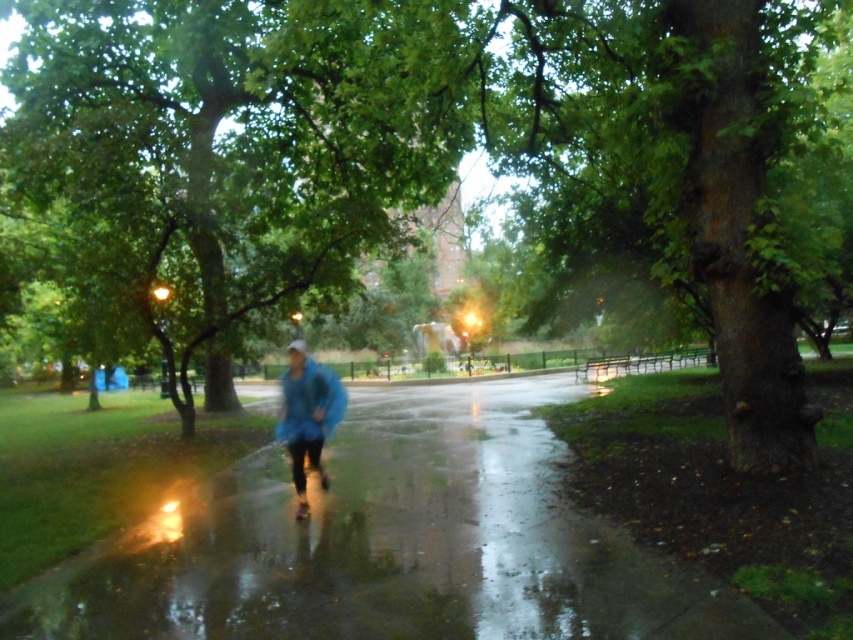
Question: Does green leafy tree at center come behind glossy asphalt pavement at center?

Choices:
 (A) no
 (B) yes

Answer: (B)

Question: Based on their relative distances, which object is farther from the green rough bark tree at right?

Choices:
 (A) green leafy tree at center
 (B) glossy asphalt pavement at center

Answer: (A)

Question: Which of the following is the farthest from the observer?

Choices:
 (A) blue matte jacket at center
 (B) glossy asphalt pavement at center
 (C) green rough bark tree at right

Answer: (A)

Question: Estimate the real-world distances between objects in this image. Which object is closer to the blue matte jacket at center?

Choices:
 (A) green rough bark tree at right
 (B) glossy asphalt pavement at center
 (C) green leafy tree at center

Answer: (B)

Question: Does green rough bark tree at right appear over blue matte jacket at center?

Choices:
 (A) yes
 (B) no

Answer: (A)

Question: Is green rough bark tree at right to the left of blue matte jacket at center from the viewer's perspective?

Choices:
 (A) no
 (B) yes

Answer: (A)